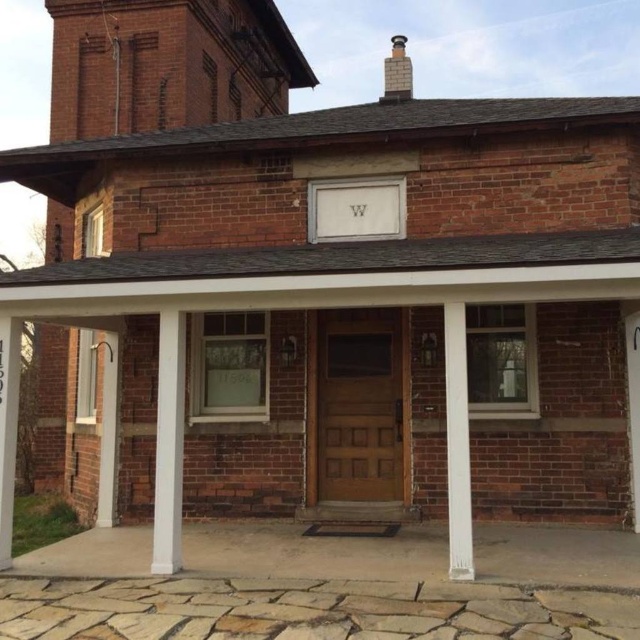
Who is positioned more to the right, white painted wood pillar at center or brick chimney at upper center?

Answer: From the viewer's perspective, brick chimney at upper center appears more on the right side.

Is white painted wood pillar at center positioned behind brick chimney at upper center?

No, white painted wood pillar at center is closer to the viewer.

Who is more distant from viewer, (452, 502) or (388, 65)?

Point (388, 65)

Image resolution: width=640 pixels, height=640 pixels. What are the coordinates of `white painted wood pillar at center` in the screenshot? It's located at (458, 444).

Is white smooth column at center above brick chimney at upper center?

No, white smooth column at center is not above brick chimney at upper center.

Between point (163, 528) and point (392, 97), which one is positioned behind?

Point (392, 97)

Locate an element on the screen. The image size is (640, 640). white smooth column at center is located at coordinates (168, 442).

In the scene shown: Is white smooth column at center to the left of white painted wood pillar at center from the viewer's perspective?

Correct, you'll find white smooth column at center to the left of white painted wood pillar at center.

Describe the element at coordinates (168, 442) in the screenshot. The width and height of the screenshot is (640, 640). I see `white smooth column at center` at that location.

This screenshot has height=640, width=640. In order to click on white smooth column at center in this screenshot , I will do `click(168, 442)`.